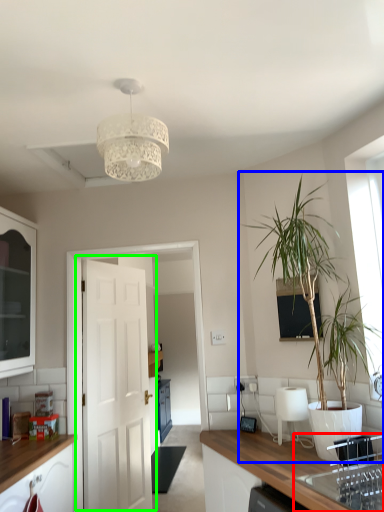
Question: Based on their relative distances, which object is farther from sink (highlighted by a red box)? Choose from houseplant (highlighted by a blue box) and door (highlighted by a green box).

Choices:
 (A) houseplant
 (B) door

Answer: (B)